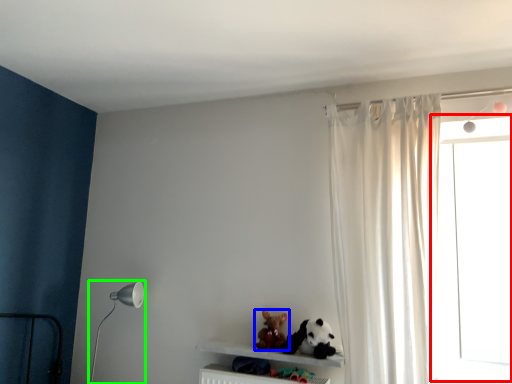
Question: Based on their relative distances, which object is nearer to window frame (highlighted by a red box)? Choose from toy (highlighted by a blue box) and table lamp (highlighted by a green box).

Choices:
 (A) toy
 (B) table lamp

Answer: (A)